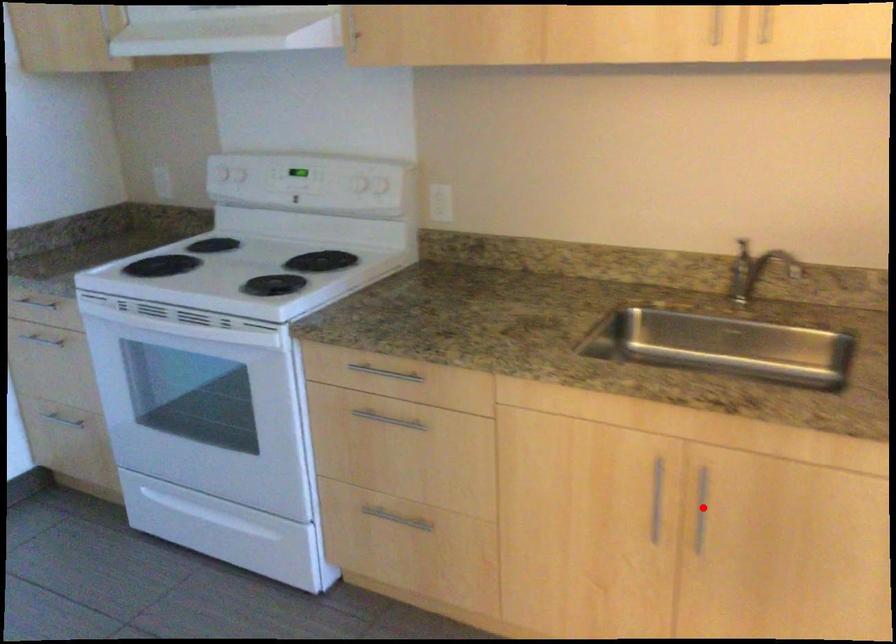
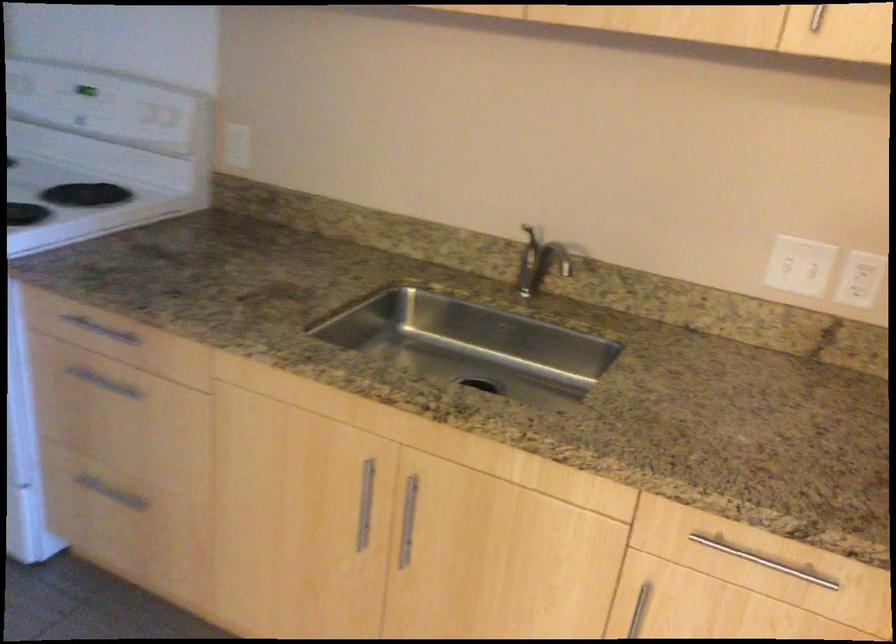
Question: A red point is marked in image1. In image2, is the corresponding 3D point closer to the camera or farther? Reply with the corresponding letter.

Choices:
 (A) The corresponding 3D point is closer.
 (B) The corresponding 3D point is farther.

Answer: (A)